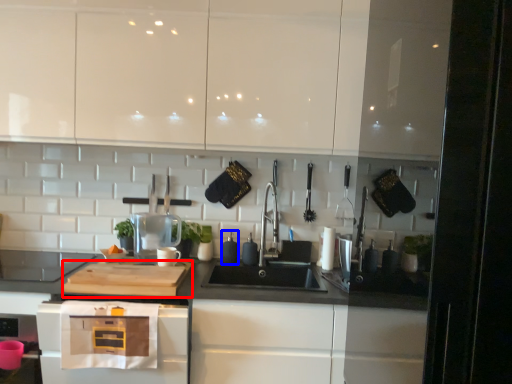
Question: Which of the following is the farthest to the observer, cutting board (highlighted by a red box) or appliance (highlighted by a blue box)?

Choices:
 (A) cutting board
 (B) appliance

Answer: (B)